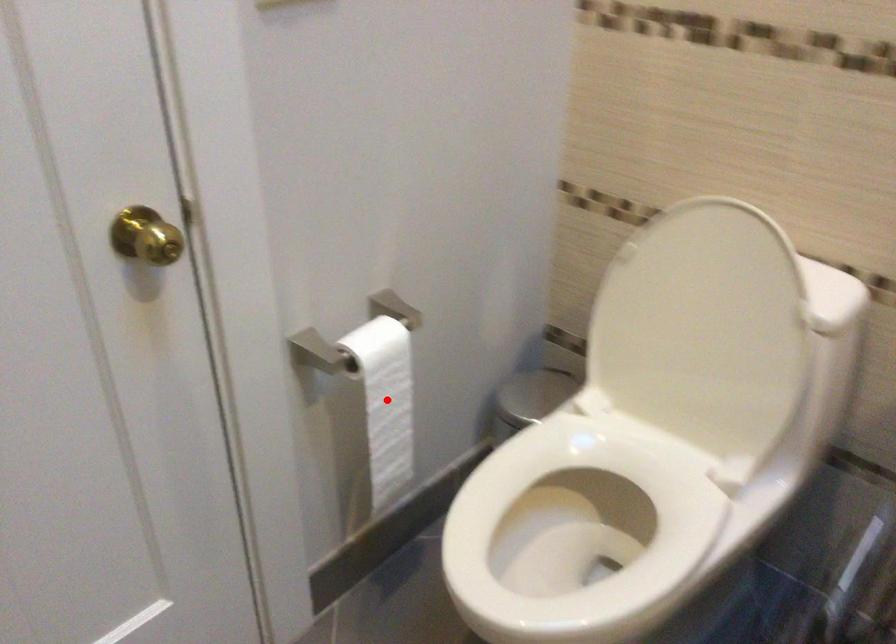
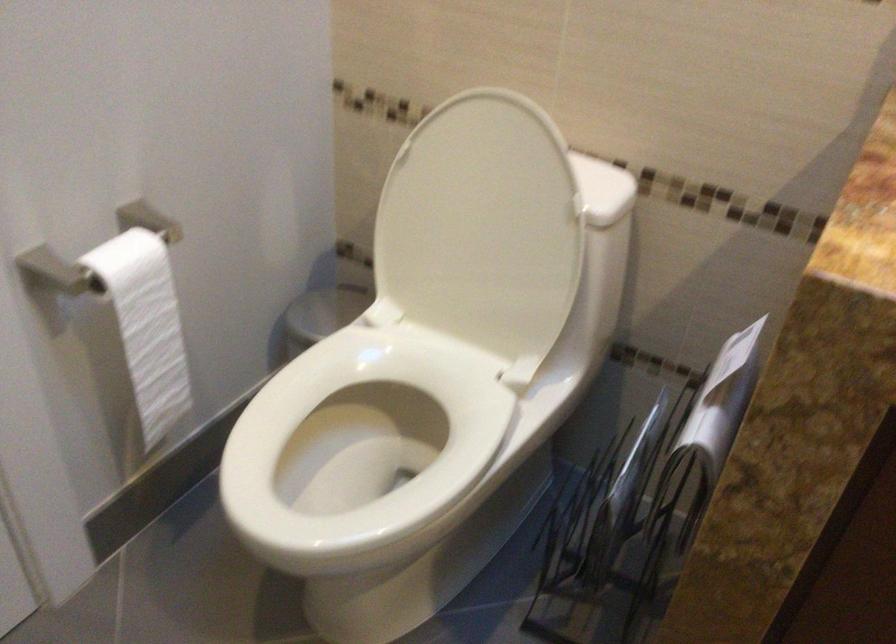
Question: I am providing you with two images of the same scene from different viewpoints. A red point is shown in image1. For the corresponding object point in image2, is it positioned nearer or farther from the camera?

Choices:
 (A) Nearer
 (B) Farther

Answer: (A)